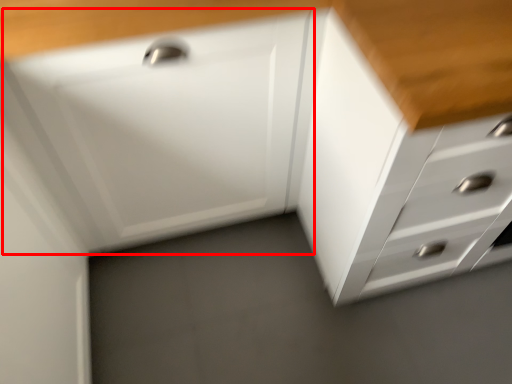
Question: Considering the relative positions of drawer (annotated by the red box) and chest of drawers in the image provided, where is drawer (annotated by the red box) located with respect to the staircase?

Choices:
 (A) left
 (B) right

Answer: (A)